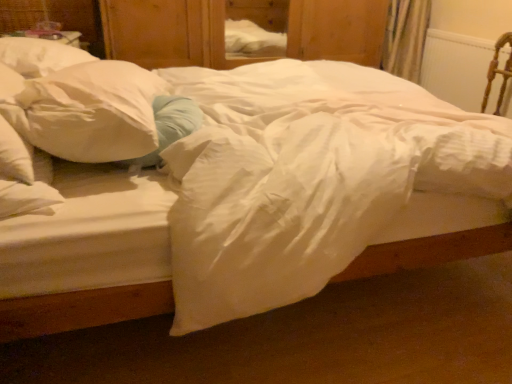
Question: Is white soft pillow at left facing away from white plastic radiator at upper right?

Choices:
 (A) yes
 (B) no

Answer: (B)

Question: Is white soft pillow at left wider than white plastic radiator at upper right?

Choices:
 (A) no
 (B) yes

Answer: (B)

Question: From the image's perspective, does white soft pillow at left appear lower than white plastic radiator at upper right?

Choices:
 (A) no
 (B) yes

Answer: (B)

Question: Does white soft pillow at left appear on the right side of white plastic radiator at upper right?

Choices:
 (A) no
 (B) yes

Answer: (A)

Question: Is white soft pillow at left positioned far away from white plastic radiator at upper right?

Choices:
 (A) yes
 (B) no

Answer: (A)

Question: Based on their positions, is white plastic radiator at upper right located to the left or right of wooden dresser at center?

Choices:
 (A) right
 (B) left

Answer: (A)

Question: From a real-world perspective, relative to wooden dresser at center, is white plastic radiator at upper right vertically above or below?

Choices:
 (A) below
 (B) above

Answer: (A)

Question: Is point (490, 96) positioned closer to the camera than point (128, 23)?

Choices:
 (A) farther
 (B) closer

Answer: (B)

Question: Considering their positions, is white plastic radiator at upper right located in front of or behind wooden dresser at center?

Choices:
 (A) front
 (B) behind

Answer: (A)

Question: Is white soft pillow at left wider or thinner than wooden armchair at right?

Choices:
 (A) thin
 (B) wide

Answer: (B)

Question: Is white soft pillow at left situated inside wooden armchair at right or outside?

Choices:
 (A) outside
 (B) inside

Answer: (A)

Question: In the image, is white soft pillow at left on the left side or the right side of wooden armchair at right?

Choices:
 (A) right
 (B) left

Answer: (B)

Question: From a real-world perspective, is white soft pillow at left above or below wooden armchair at right?

Choices:
 (A) above
 (B) below

Answer: (A)

Question: From the image's perspective, is white plastic radiator at upper right positioned above or below wooden armchair at right?

Choices:
 (A) below
 (B) above

Answer: (B)

Question: Based on their sizes in the image, would you say white plastic radiator at upper right is bigger or smaller than wooden armchair at right?

Choices:
 (A) big
 (B) small

Answer: (B)